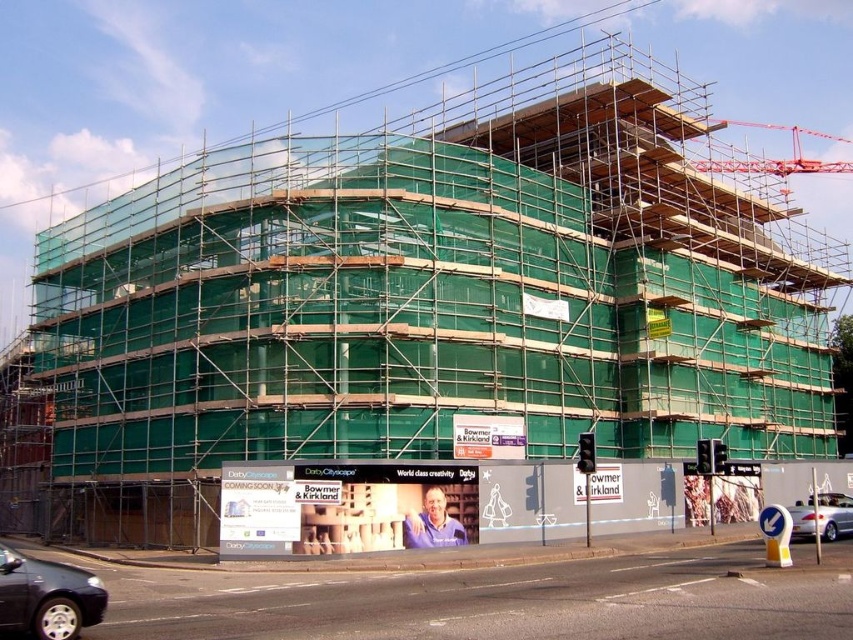
You are a delivery driver who needs to park your truck between the shiny black sedan at lower left and the silver metallic car at lower right. Is there enough space between them for your truck?

The shiny black sedan at lower left is to the left of the silver metallic car at lower right, but the distance between them is not specified. Without knowing the exact space, it is impossible to determine if your truck can fit between them.

You are standing at the camera position and want to reach the point marked as point (9,577). If your walking speed is 3 feet per second, how many seconds will it take to reach the point?

The distance between point (9,577) and the camera is 89.08 feet. At a speed of 3 feet per second, it would take approximately 29.69 seconds to reach the point.

You are a delivery driver approaching the construction site. You need to park your vehicle between the shiny black sedan at lower left and the silver metallic car at lower right. Which side of the road should you choose to park on?

You should park on the side closer to the shiny black sedan at lower left because it is nearer to you than the silver metallic car at lower right, allowing for easier access.